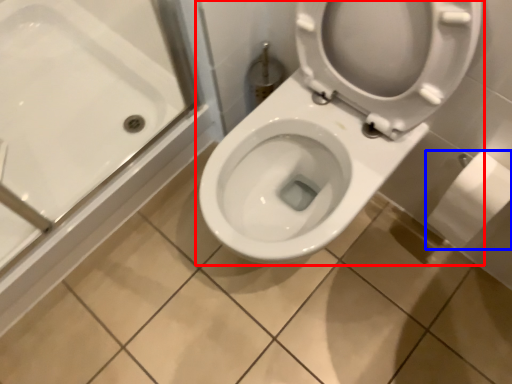
Question: Which point is closer to the camera, toilet (highlighted by a red box) or toilet paper (highlighted by a blue box)?

Choices:
 (A) toilet
 (B) toilet paper

Answer: (A)